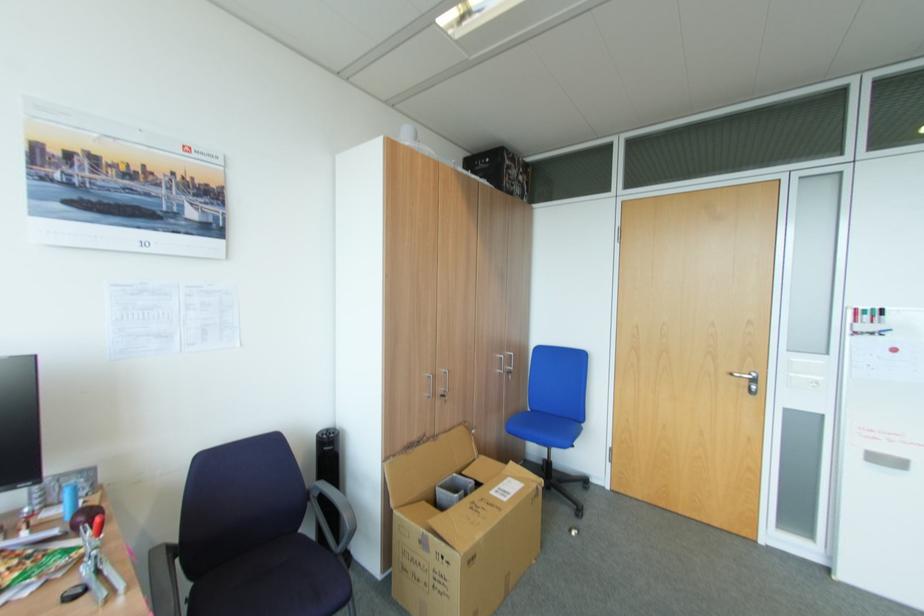
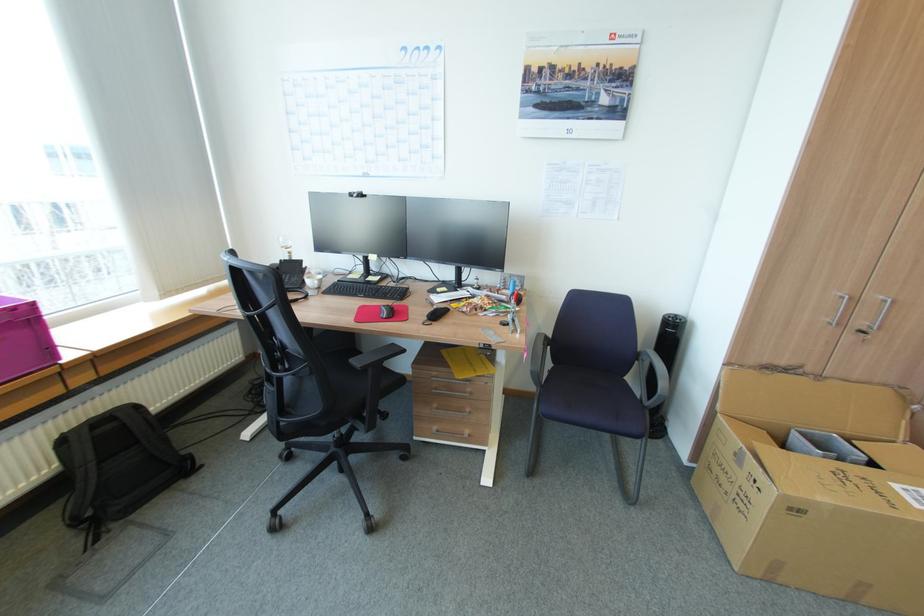
Where in the second image is the point corresponding to point (312, 487) from the first image?

(643, 350)